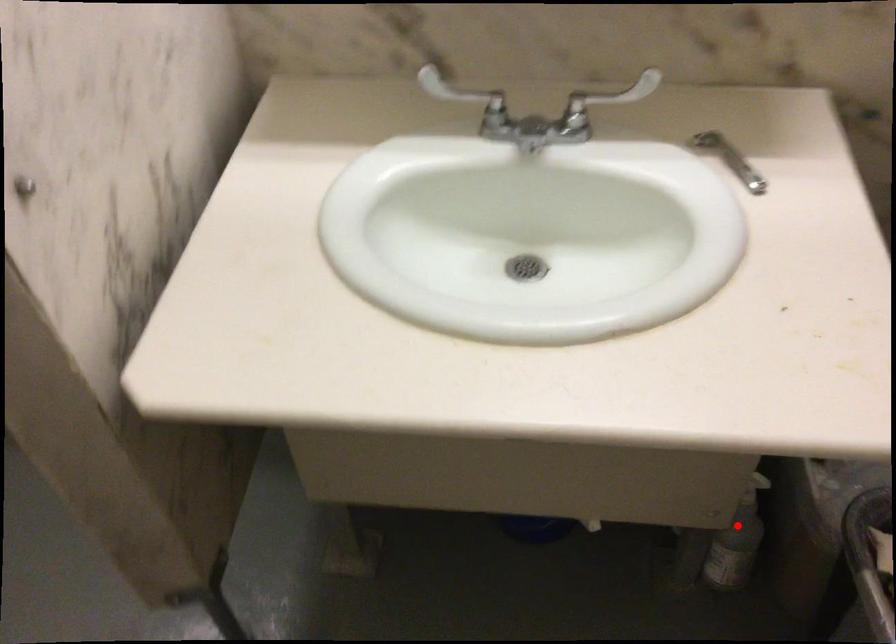
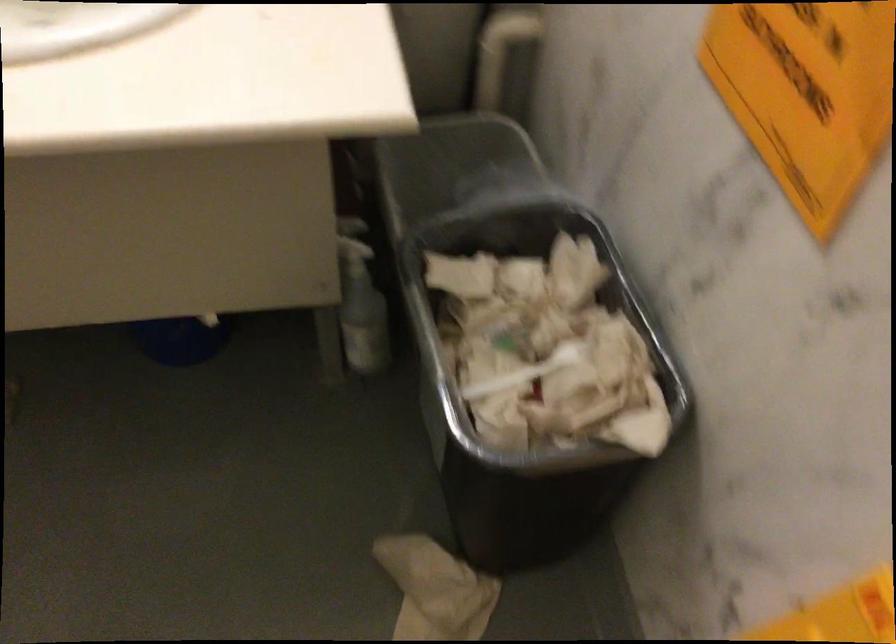
Find the pixel in the second image that matches the highlighted location in the first image.

(360, 303)